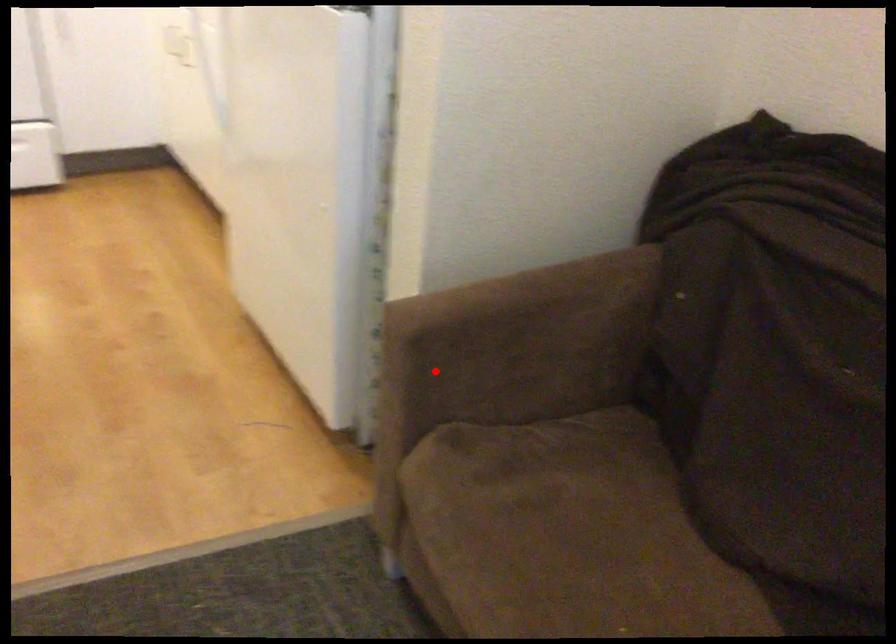
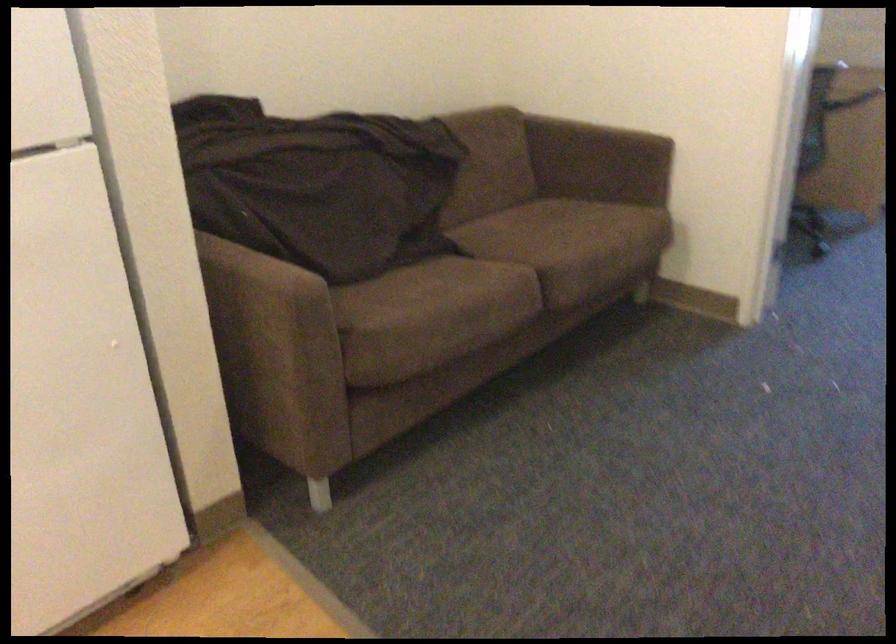
Question: I am providing you with two images of the same scene from different viewpoints. Image1 has a red point marked. In image2, the corresponding 3D location appears at what relative position? Reply with the corresponding letter.

Choices:
 (A) Closer
 (B) Farther

Answer: (B)